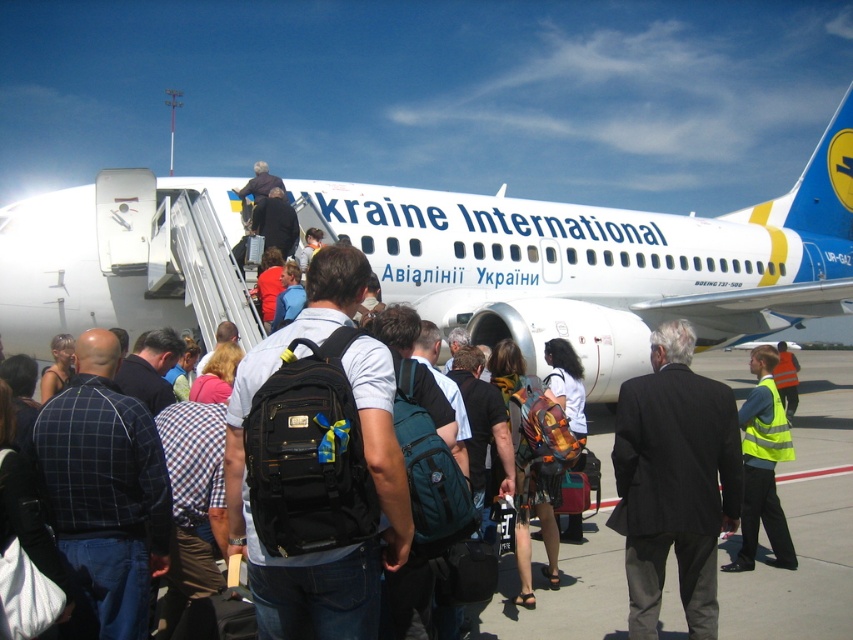
Question: From the image, what is the correct spatial relationship of white matte airplane at center in relation to yellow reflective vest at center?

Choices:
 (A) right
 (B) left

Answer: (B)

Question: Which point is farther from the camera taking this photo?

Choices:
 (A) (654, 582)
 (B) (221, 216)

Answer: (B)

Question: Which object is positioned closest to the dark gray suit at center?

Choices:
 (A) yellow reflective vest at center
 (B) white matte airplane at center

Answer: (A)

Question: Does white matte airplane at center have a greater width compared to yellow reflective vest at center?

Choices:
 (A) no
 (B) yes

Answer: (B)

Question: Can you confirm if white matte airplane at center is positioned to the left of yellow reflective vest at center?

Choices:
 (A) no
 (B) yes

Answer: (B)

Question: Which of the following is the closest to the observer?

Choices:
 (A) white matte airplane at center
 (B) yellow reflective vest at center
 (C) dark gray suit at center

Answer: (C)